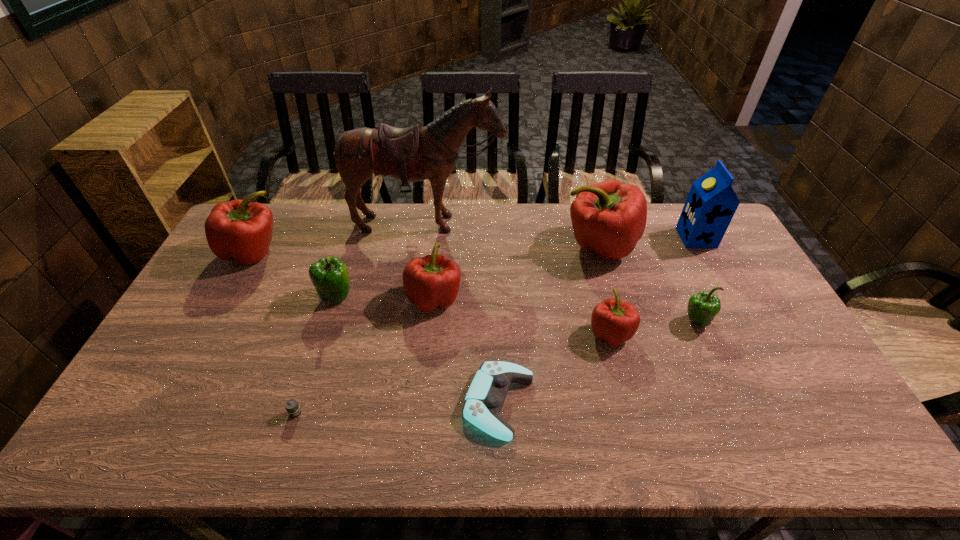
Identify which object is the sixth closest to the saddle. Please provide its 2D coordinates. Your answer should be formatted as a tuple, i.e. [(x, y)], where the tuple contains the x and y coordinates of a point satisfying the conditions above.

[(486, 395)]

This screenshot has height=540, width=960. In order to click on object that is the seventh closest one to the leftmost pink bell pepper in this screenshot , I will do `click(613, 321)`.

I want to click on bell pepper that is the closest one to the blue carton, so click(x=609, y=217).

Identify which bell pepper is the second nearest to the second bell pepper from left to right. Please provide its 2D coordinates. Your answer should be formatted as a tuple, i.e. [(x, y)], where the tuple contains the x and y coordinates of a point satisfying the conditions above.

[(239, 230)]

Locate which pink bell pepper is the second closest to the second shortest object. Please provide its 2D coordinates. Your answer should be formatted as a tuple, i.e. [(x, y)], where the tuple contains the x and y coordinates of a point satisfying the conditions above.

[(613, 321)]

At what (x,y) coordinates should I click in order to perform the action: click on pink bell pepper that can be found as the closest to the third smallest pink bell pepper. Please return your answer as a coordinate pair (x, y). This screenshot has width=960, height=540. Looking at the image, I should click on (433, 281).

Image resolution: width=960 pixels, height=540 pixels. Find the location of `free space that satisfies the following two spatial constraints: 1. on the back of the brown saddle; 2. on the left side of the third bell pepper from left to right`. free space that satisfies the following two spatial constraints: 1. on the back of the brown saddle; 2. on the left side of the third bell pepper from left to right is located at coordinates (418, 299).